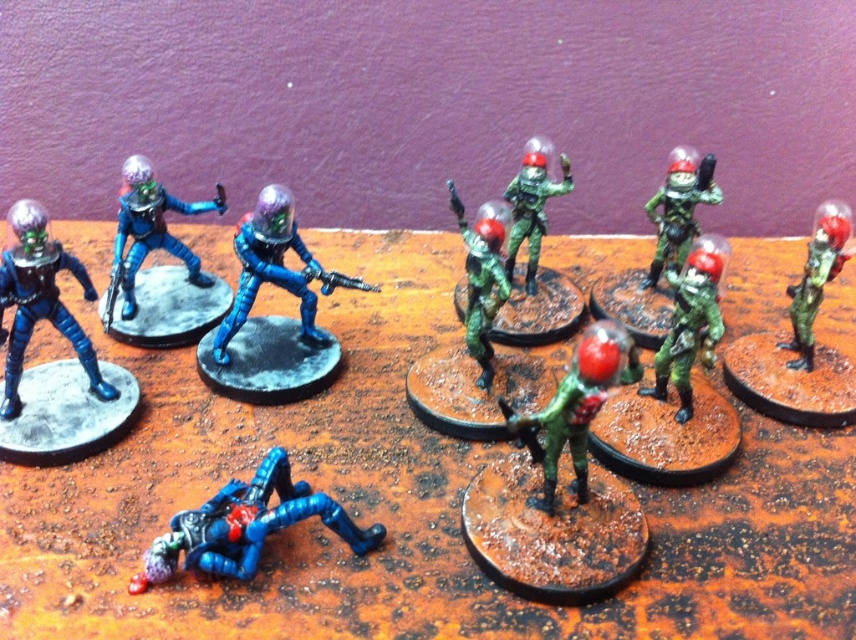
Question: Which object is farther from the camera taking this photo?

Choices:
 (A) green matte figure at center
 (B) brushed metal figure at lower left
 (C) green matte helmet at center
 (D) green matte helmet at upper right

Answer: (D)

Question: Which object is the closest to the brushed metal figure at lower left?

Choices:
 (A) green matte helmet at upper right
 (B) green matte figure at center
 (C) green matte helmeted soldier at center
 (D) green matte helmet at center

Answer: (B)

Question: Is brushed metal figure at center bigger than green matte helmet at center?

Choices:
 (A) yes
 (B) no

Answer: (A)

Question: Which object is the closest to the green matte figure at center right?

Choices:
 (A) green matte helmeted soldier at center
 (B) brushed metal figure at lower left
 (C) green matte figure at center

Answer: (A)

Question: Is metallic blue figure at upper left further to camera compared to green matte figure at center right?

Choices:
 (A) yes
 (B) no

Answer: (B)

Question: Considering the relative positions of brushed metal figure at left and brushed metal figure at center in the image provided, where is brushed metal figure at left located with respect to brushed metal figure at center?

Choices:
 (A) left
 (B) right

Answer: (A)